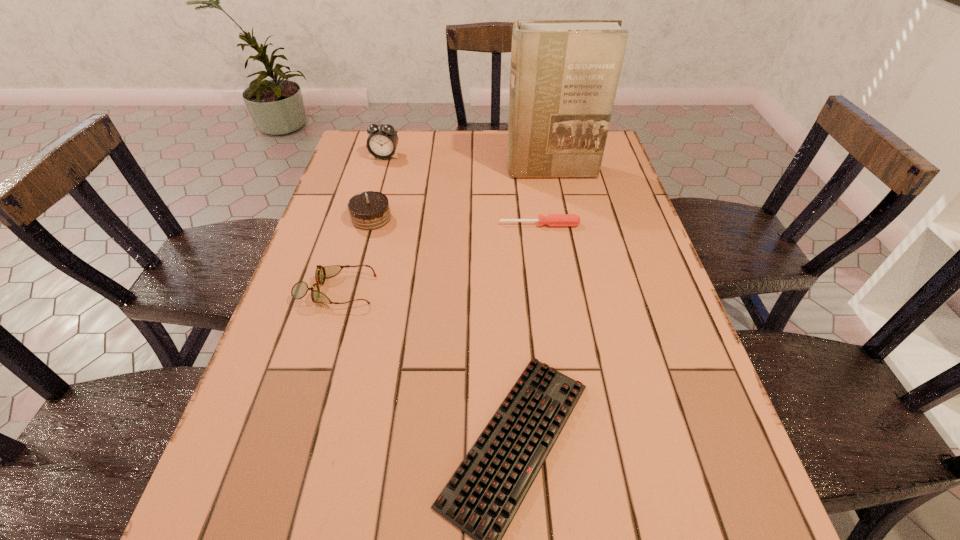
Locate an element on the screen. empty space that is in between the fifth tallest object and the chocolate cake is located at coordinates (455, 221).

Locate an element on the screen. This screenshot has height=540, width=960. free space between the fifth tallest object and the fifth nearest object is located at coordinates (545, 198).

I want to click on the third closest object to the alarm clock, so click(552, 220).

Choose which object is the fourth nearest neighbor to the alarm clock. Please provide its 2D coordinates. Your answer should be formatted as a tuple, i.e. [(x, y)], where the tuple contains the x and y coordinates of a point satisfying the conditions above.

[(299, 290)]

Image resolution: width=960 pixels, height=540 pixels. What are the coordinates of `vacant area that satisfies the following two spatial constraints: 1. on the front side of the second shortest object; 2. on the front-facing side of the third shortest object` in the screenshot? It's located at (549, 290).

Find the location of a particular element. Image resolution: width=960 pixels, height=540 pixels. vacant region that satisfies the following two spatial constraints: 1. on the cover of the phonebook; 2. on the front-facing side of the fourth tallest object is located at coordinates (575, 290).

At what (x,y) coordinates should I click in order to perform the action: click on vacant space that satisfies the following two spatial constraints: 1. on the front side of the farthest object; 2. on the left side of the third tallest object. Please return your answer as a coordinate pair (x, y). This screenshot has height=540, width=960. Looking at the image, I should click on (367, 218).